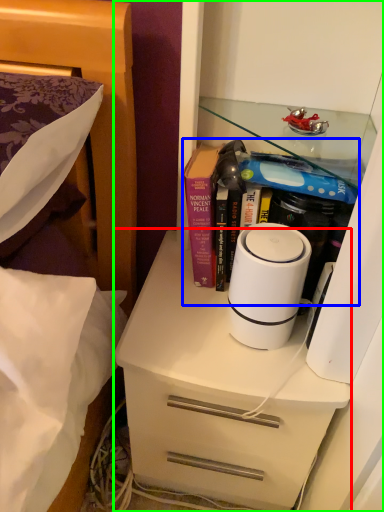
Question: Which object is the farthest from chest of drawers (highlighted by a red box)? Choose among these: book (highlighted by a blue box) or cabinetry (highlighted by a green box).

Choices:
 (A) book
 (B) cabinetry

Answer: (B)